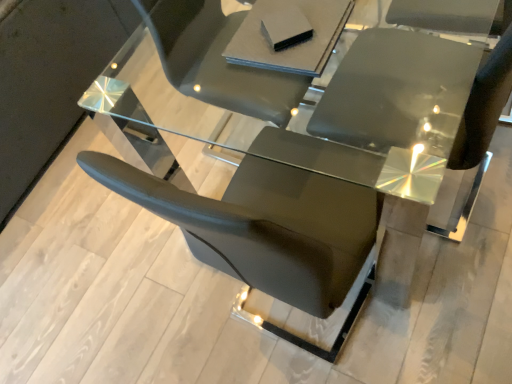
Question: Is transparent glass table at center, positioned as the second table in bottom-to-top order, far away from glossy black chair at center?

Choices:
 (A) no
 (B) yes

Answer: (A)

Question: From a real-world perspective, is transparent glass table at center, arranged as the 1th table when viewed from the top, on top of glossy black chair at center?

Choices:
 (A) no
 (B) yes

Answer: (A)

Question: Can you confirm if transparent glass table at center, positioned as the second table in bottom-to-top order, is positioned to the right of glossy black chair at center?

Choices:
 (A) no
 (B) yes

Answer: (A)

Question: Is transparent glass table at center, arranged as the 1th table when viewed from the top, closer to camera compared to glossy black chair at center?

Choices:
 (A) no
 (B) yes

Answer: (A)

Question: Is transparent glass table at center, which is the 2th table in back-to-front order, turned away from glossy black chair at center?

Choices:
 (A) no
 (B) yes

Answer: (B)

Question: In terms of size, does glossy black chair at center appear bigger or smaller than transparent glass table at center, positioned as the second table in bottom-to-top order?

Choices:
 (A) small
 (B) big

Answer: (A)

Question: Considering the relative positions of glossy black chair at center and transparent glass table at center, arranged as the 1th table when viewed from the top, in the image provided, is glossy black chair at center to the left or to the right of transparent glass table at center, arranged as the 1th table when viewed from the top,?

Choices:
 (A) right
 (B) left

Answer: (A)

Question: In terms of height, does glossy black chair at center look taller or shorter compared to transparent glass table at center, positioned as the second table in bottom-to-top order?

Choices:
 (A) tall
 (B) short

Answer: (A)

Question: Looking at their shapes, would you say glossy black chair at center is wider or thinner than transparent glass table at center, which is the 2th table in back-to-front order?

Choices:
 (A) wide
 (B) thin

Answer: (B)

Question: Does point (305, 41) appear closer or farther from the camera than point (344, 84)?

Choices:
 (A) farther
 (B) closer

Answer: (B)

Question: From a real-world perspective, relative to glossy black chair at center, is matte gray book at upper center, positioned as the 2th table in top-to-bottom order, vertically above or below?

Choices:
 (A) above
 (B) below

Answer: (A)

Question: Relative to glossy black chair at center, is matte gray book at upper center, which is the second table from front to back, in front or behind?

Choices:
 (A) behind
 (B) front

Answer: (A)

Question: Considering the positions of matte gray book at upper center, positioned as the 2th table in top-to-bottom order, and glossy black chair at center in the image, is matte gray book at upper center, positioned as the 2th table in top-to-bottom order, taller or shorter than glossy black chair at center?

Choices:
 (A) short
 (B) tall

Answer: (A)

Question: From a real-world perspective, is matte gray book at upper center, positioned as the 2th table in top-to-bottom order, physically located above or below transparent glass table at center, which is the 2th table in back-to-front order?

Choices:
 (A) above
 (B) below

Answer: (A)

Question: In terms of height, does matte gray book at upper center, positioned as the 2th table in top-to-bottom order, look taller or shorter compared to transparent glass table at center, arranged as the first table when viewed from the front?

Choices:
 (A) short
 (B) tall

Answer: (A)